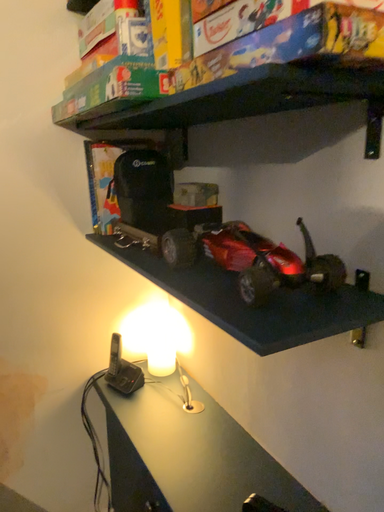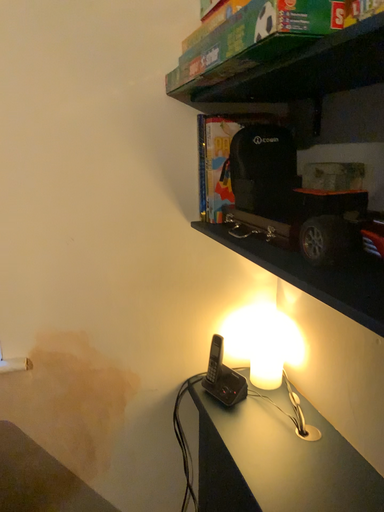
Question: How did the camera likely rotate when shooting the video?

Choices:
 (A) rotated left
 (B) rotated right

Answer: (A)